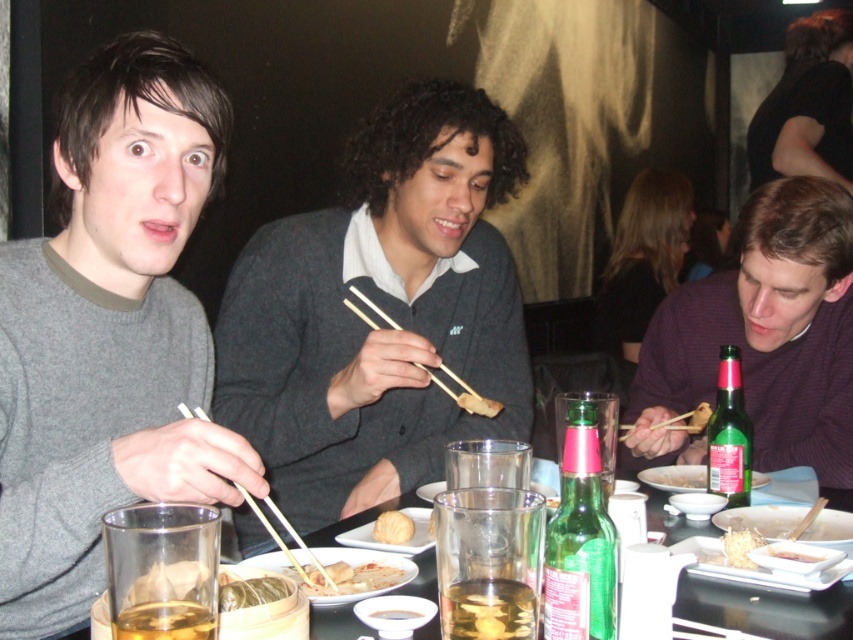
You are a waiter in a restaurant and need to place a new order of a large plate onto the table. The table has the gray wool sweater at left and the clear glass at center. Which object should you avoid placing the plate near to prevent it from being obstructed by the larger item?

You should avoid placing the plate near the gray wool sweater at left because it is larger than the clear glass at center and may obstruct the plate.

You are a server at the restaurant and need to place a new drink order on the table. The drink must be placed to the right of the dark gray sweater at center and to the left of the translucent glass at table center. Is there enough space between them to fit the drink?

The dark gray sweater at center is wider than the translucent glass at table center. Since the sweater is wider, there might be sufficient space between them to place the drink, but the exact distance isn

You are a waiter in a restaurant and need to deliver a dessert plate to the table. The dessert plate is quite large and requires placing it between the dark gray sweater at center and the green glass bottle at right. Can you fit the dessert plate between them?

The dark gray sweater at center is located above the green glass bottle at right, so there is vertical space between them. However, the horizontal distance isn let the description determine the answer. Since the Objects Description only mentions vertical positioning, we cannot confirm horizontal space. Therefore, the waiter should check the horizontal distance before placing the dessert plate between them.